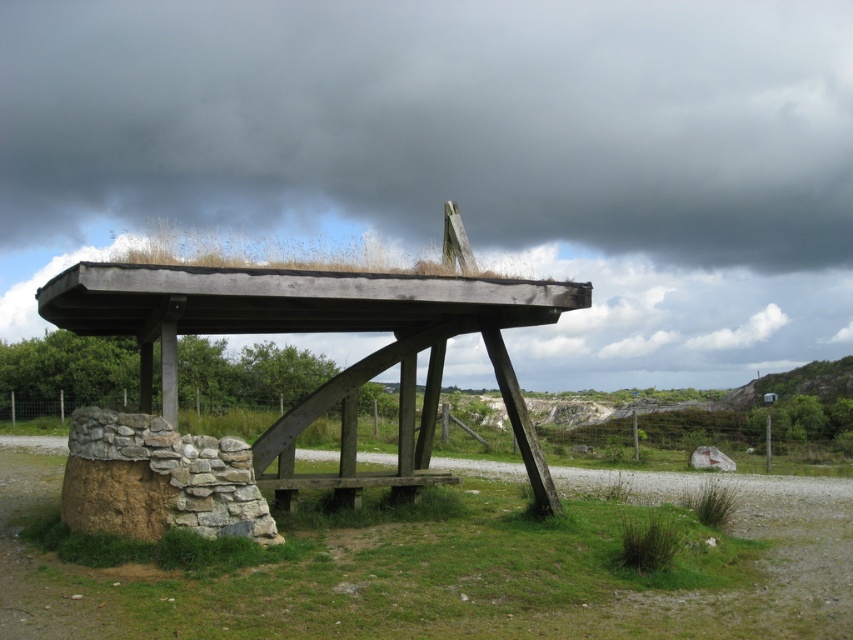
You are planning to place a new flower pot between the wooden gazebo at center and the brown wooden bench at center. Based on their positions, which side of the bench should you place the flower pot to ensure it is between them?

The wooden gazebo at center is to the left of the brown wooden bench at center, so placing the flower pot to the left side of the bench would position it between the wooden gazebo at center and the brown wooden bench at center.

You are planning to place a new decorative pot that is 2 meters wide in the center of the wooden gazebo at center. Considering the brown wooden bench at center is already there, will the pot fit within the gazebo without overlapping the bench?

The wooden gazebo at center is wider than the brown wooden bench at center. Since the gazebo is wider, there should be enough space to place the 2m wide pot in the center without overlapping the bench, provided the bench isn not directly in the center.

You are planning to install a new lighting fixture that requires a minimum height of 2 meters. Based on the scene, can the wooden gazebo at center support the fixture above the brown wooden bench at center?

The wooden gazebo at center is much taller than the brown wooden bench at center, so it can support the lighting fixture above the bench as long as the required height is met.